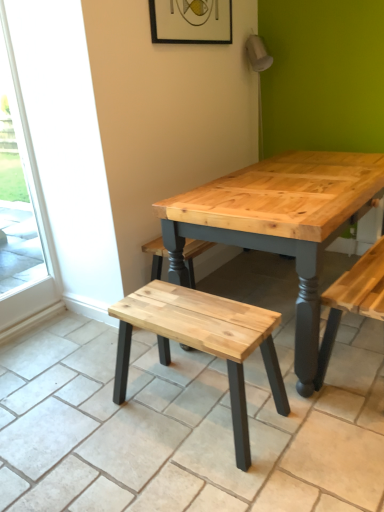
Locate an element on the screen. Image resolution: width=384 pixels, height=512 pixels. vacant space situated above natural wood stool at center (from a real-world perspective) is located at coordinates (196, 309).